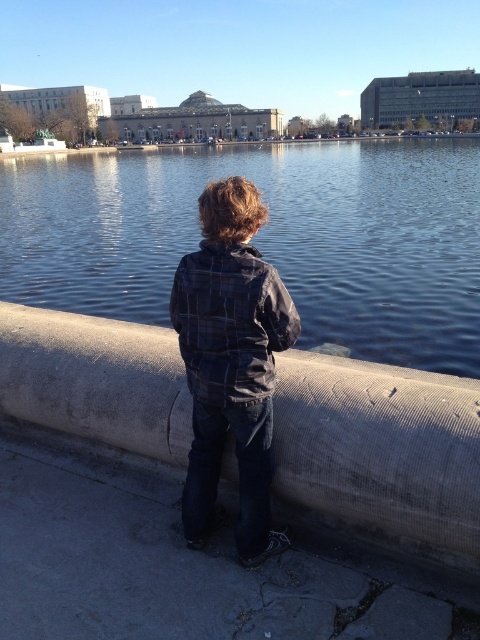
Who is positioned more to the right, plaid fabric jacket at center or plaid cotton jacket at center?

plaid cotton jacket at center

How much distance is there between plaid fabric jacket at center and plaid cotton jacket at center?

They are 13.54 inches apart.

Where is `plaid fabric jacket at center`? Image resolution: width=480 pixels, height=640 pixels. plaid fabric jacket at center is located at coordinates [x=230, y=362].

Is blue water at center below concrete at center?

No, blue water at center is not below concrete at center.

Which is in front, point (110, 161) or point (451, 436)?

Point (451, 436) is more forward.

Locate an element on the screen. blue water at center is located at coordinates (264, 237).

Does concrete at center have a larger size compared to plaid cotton jacket at center?

Yes, concrete at center is bigger than plaid cotton jacket at center.

In the scene shown: Who is positioned more to the left, concrete at center or plaid cotton jacket at center?

concrete at center is more to the left.

I want to click on concrete at center, so click(381, 449).